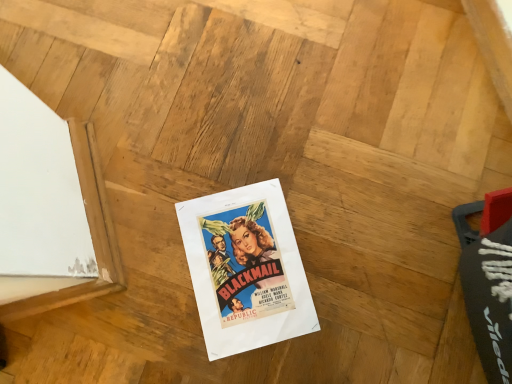
I want to click on blank space situated above matte paper poster at center (from a real-world perspective), so click(245, 269).